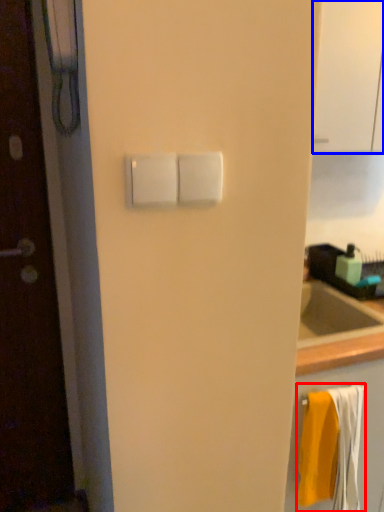
Question: Which of the following is the closest to the observer, bath towel (highlighted by a red box) or glass door (highlighted by a blue box)?

Choices:
 (A) bath towel
 (B) glass door

Answer: (B)